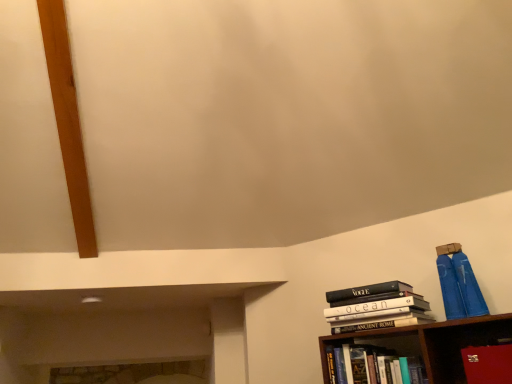
Question: Can you confirm if hardcover book at lower right, which is the 2th book in top-to-bottom order, is shorter than red leather book at lower right?

Choices:
 (A) yes
 (B) no

Answer: (B)

Question: Does hardcover book at lower right, which is the first book in bottom-to-top order, have a smaller size compared to red leather book at lower right?

Choices:
 (A) no
 (B) yes

Answer: (A)

Question: Considering the relative sizes of hardcover book at lower right, which is the first book in bottom-to-top order, and red leather book at lower right in the image provided, is hardcover book at lower right, which is the first book in bottom-to-top order, taller than red leather book at lower right?

Choices:
 (A) no
 (B) yes

Answer: (B)

Question: Considering the relative sizes of hardcover book at lower right, which is the 2th book in top-to-bottom order, and red leather book at lower right in the image provided, is hardcover book at lower right, which is the 2th book in top-to-bottom order, bigger than red leather book at lower right?

Choices:
 (A) yes
 (B) no

Answer: (A)

Question: Considering the relative positions of hardcover book at lower right, which is the first book in bottom-to-top order, and red leather book at lower right in the image provided, is hardcover book at lower right, which is the first book in bottom-to-top order, in front of red leather book at lower right?

Choices:
 (A) yes
 (B) no

Answer: (B)

Question: From a real-world perspective, is hardcover book at lower right, which is the first book in bottom-to-top order, physically below red leather book at lower right?

Choices:
 (A) yes
 (B) no

Answer: (B)

Question: Does red leather book at lower right have a larger size compared to hardcover books at right, placed as the second book when sorted from bottom to top?

Choices:
 (A) yes
 (B) no

Answer: (B)

Question: Can you confirm if red leather book at lower right is thinner than hardcover books at right, placed as the first book when sorted from top to bottom?

Choices:
 (A) yes
 (B) no

Answer: (A)

Question: Considering the relative sizes of red leather book at lower right and hardcover books at right, placed as the first book when sorted from top to bottom, in the image provided, is red leather book at lower right taller than hardcover books at right, placed as the first book when sorted from top to bottom,?

Choices:
 (A) no
 (B) yes

Answer: (A)

Question: Considering the relative positions of red leather book at lower right and hardcover books at right, placed as the first book when sorted from top to bottom, in the image provided, is red leather book at lower right behind hardcover books at right, placed as the first book when sorted from top to bottom,?

Choices:
 (A) yes
 (B) no

Answer: (B)

Question: Does red leather book at lower right have a greater width compared to hardcover books at right, placed as the second book when sorted from bottom to top?

Choices:
 (A) yes
 (B) no

Answer: (B)

Question: Could you tell me if red leather book at lower right is turned towards hardcover books at right, placed as the first book when sorted from top to bottom?

Choices:
 (A) no
 (B) yes

Answer: (A)

Question: Considering the relative sizes of hardcover book at lower right, which is the 2th book in top-to-bottom order, and hardcover books at right, placed as the first book when sorted from top to bottom, in the image provided, is hardcover book at lower right, which is the 2th book in top-to-bottom order, wider than hardcover books at right, placed as the first book when sorted from top to bottom,?

Choices:
 (A) yes
 (B) no

Answer: (B)